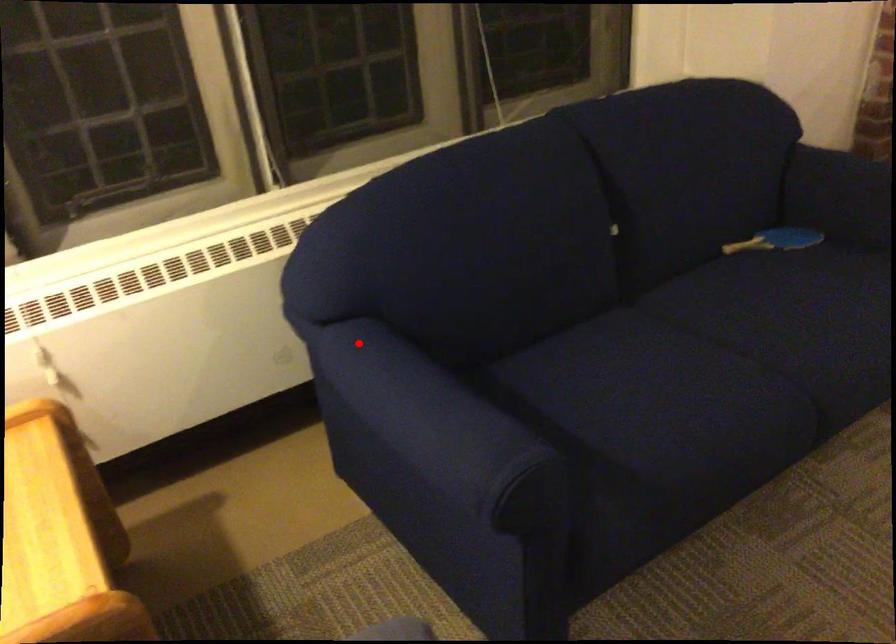
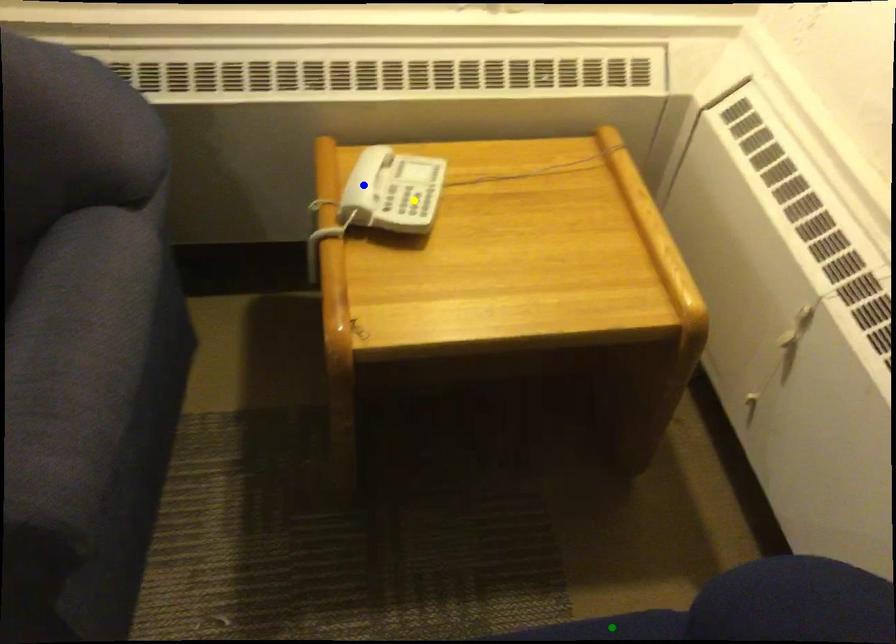
Question: I am providing you with two images of the same scene from different viewpoints. A red point is marked on the first image. You are given multiple points on the second image. Can you choose the point in image 2 that corresponds to the point in image 1?

Choices:
 (A) yellow point
 (B) green point
 (C) blue point

Answer: (B)